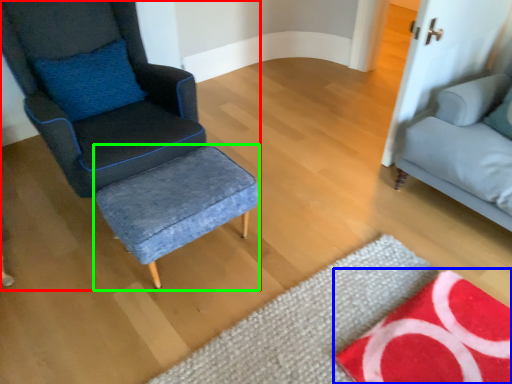
Question: Considering the real-world distances, which object is closest to chair (highlighted by a red box)? mat (highlighted by a blue box) or stool (highlighted by a green box).

Choices:
 (A) mat
 (B) stool

Answer: (B)